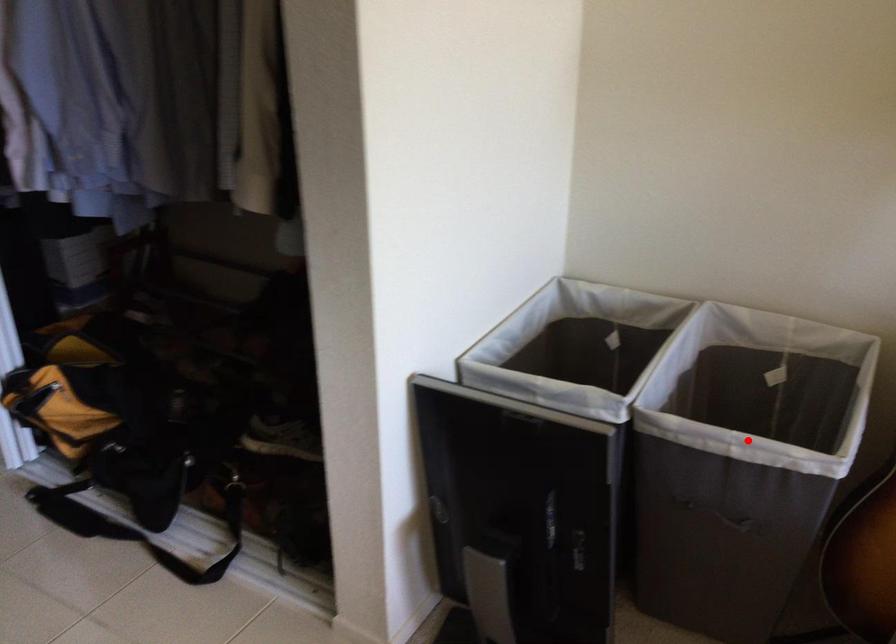
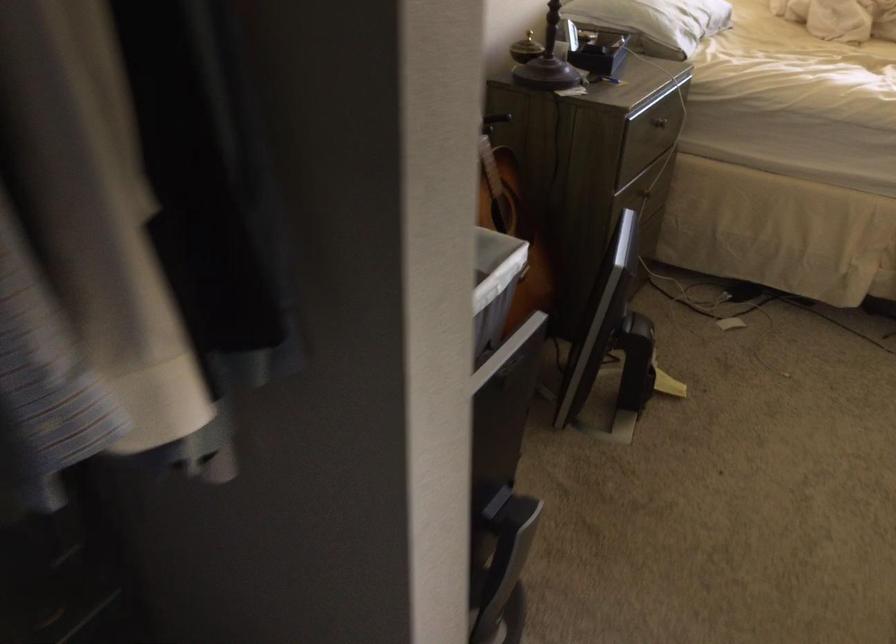
Find the pixel in the second image that matches the highlighted location in the first image.

(494, 286)